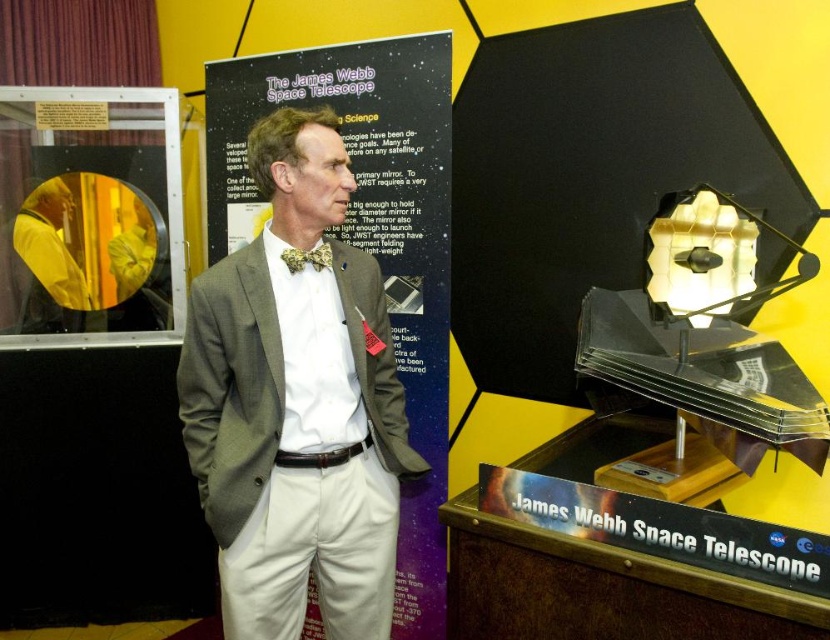
Who is shorter, gray textured suit at center or floral silk bow tie at center?

floral silk bow tie at center

Can you confirm if gray textured suit at center is positioned below floral silk bow tie at center?

Correct, gray textured suit at center is located below floral silk bow tie at center.

This screenshot has width=830, height=640. I want to click on gray textured suit at center, so click(296, 403).

Identify the location of yellow fabric at center. The image size is (830, 640). (49, 260).

Identify the location of yellow fabric at center. (49, 260).

Based on the photo, between gray textured suit at center and yellow fabric at center, which one is positioned higher?

yellow fabric at center is above.

Does gray textured suit at center come behind yellow fabric at center?

No, it is in front of yellow fabric at center.

Who is more forward, (276, 520) or (74, 326)?

Positioned in front is point (276, 520).

This screenshot has width=830, height=640. In order to click on gray textured suit at center in this screenshot , I will do `click(296, 403)`.